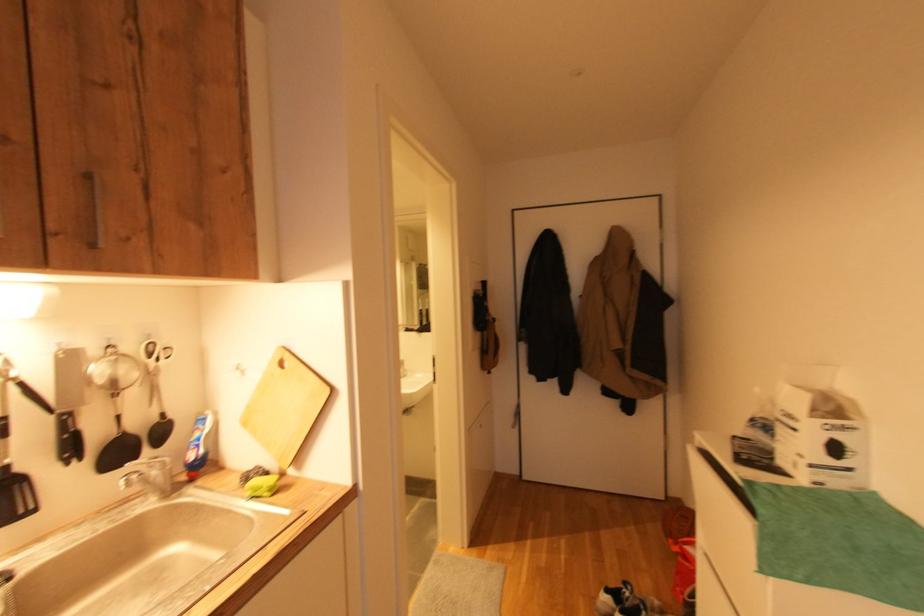
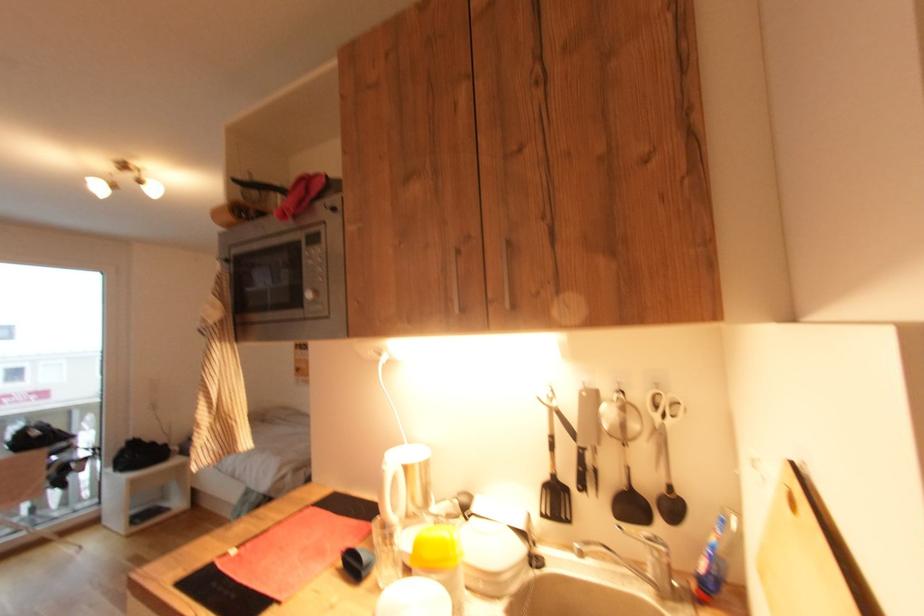
Question: The camera is either moving clockwise (left) or counter-clockwise (right) around the object. The first image is from the beginning of the video and the second image is from the end. Is the camera moving left or right when shooting the video?

Choices:
 (A) Left
 (B) Right

Answer: (B)